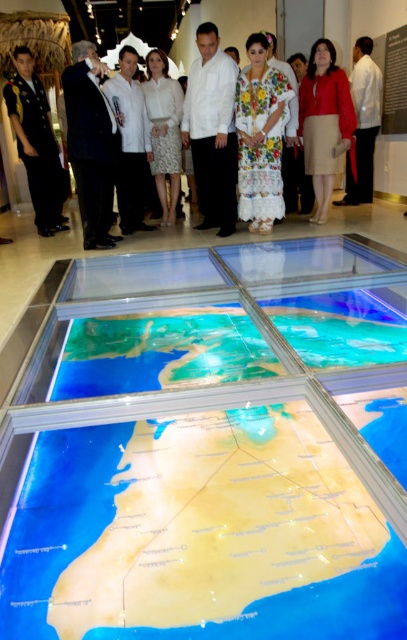
Does embroidered fabric dress at center appear under white lace dress at upper center?

Correct, embroidered fabric dress at center is located below white lace dress at upper center.

Is embroidered fabric dress at center positioned in front of white lace dress at upper center?

Yes, it is.

Is point (247, 218) closer to camera compared to point (19, 35)?

Yes.

Locate an element on the screen. The width and height of the screenshot is (407, 640). embroidered fabric dress at center is located at coordinates (260, 136).

Between embroidered fabric dress at center and white textured dress at center, which one is positioned higher?

white textured dress at center

Does embroidered fabric dress at center have a larger size compared to white textured dress at center?

Indeed, embroidered fabric dress at center has a larger size compared to white textured dress at center.

Image resolution: width=407 pixels, height=640 pixels. Describe the element at coordinates (260, 136) in the screenshot. I see `embroidered fabric dress at center` at that location.

Identify the location of embroidered fabric dress at center. The image size is (407, 640). (260, 136).

Does embroidered fabric dress at center appear on the right side of white cotton dress at upper center?

Incorrect, embroidered fabric dress at center is not on the right side of white cotton dress at upper center.

Can you confirm if embroidered fabric dress at center is thinner than white cotton dress at upper center?

No, embroidered fabric dress at center is not thinner than white cotton dress at upper center.

Does point (256, 136) lie in front of point (367, 96)?

Yes, it is in front of point (367, 96).

Identify the location of embroidered fabric dress at center. (260, 136).